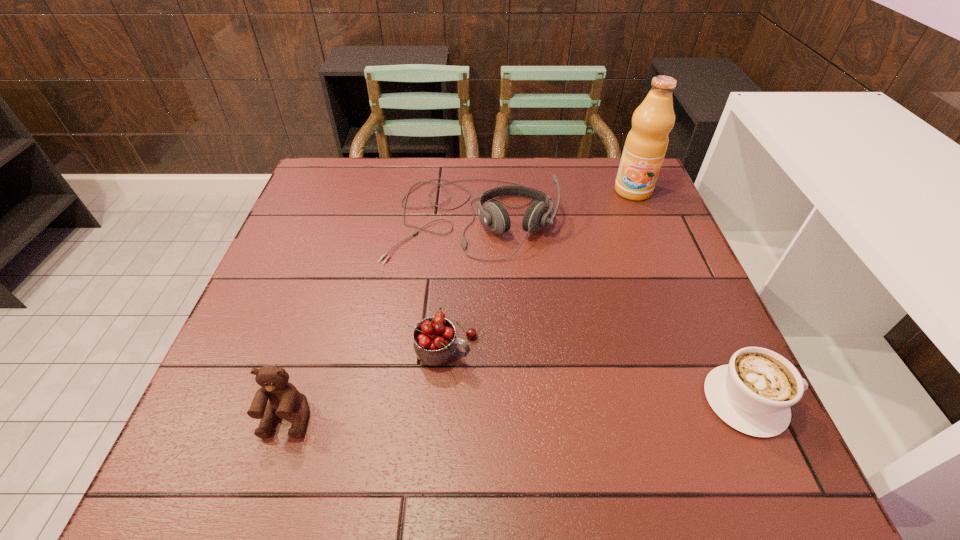
Locate an element on the screen. The image size is (960, 540). free space between the teddy bear and the headset is located at coordinates (380, 318).

Choose which object is the nearest neighbor to the tallest object. Please provide its 2D coordinates. Your answer should be formatted as a tuple, i.e. [(x, y)], where the tuple contains the x and y coordinates of a point satisfying the conditions above.

[(494, 215)]

Where is `object that ranks as the closest to the headset`? object that ranks as the closest to the headset is located at coordinates (435, 343).

I want to click on vacant space that satisfies the following two spatial constraints: 1. on the front side of the shortest object; 2. to the right of the fruit juice's handle, so pyautogui.click(x=719, y=401).